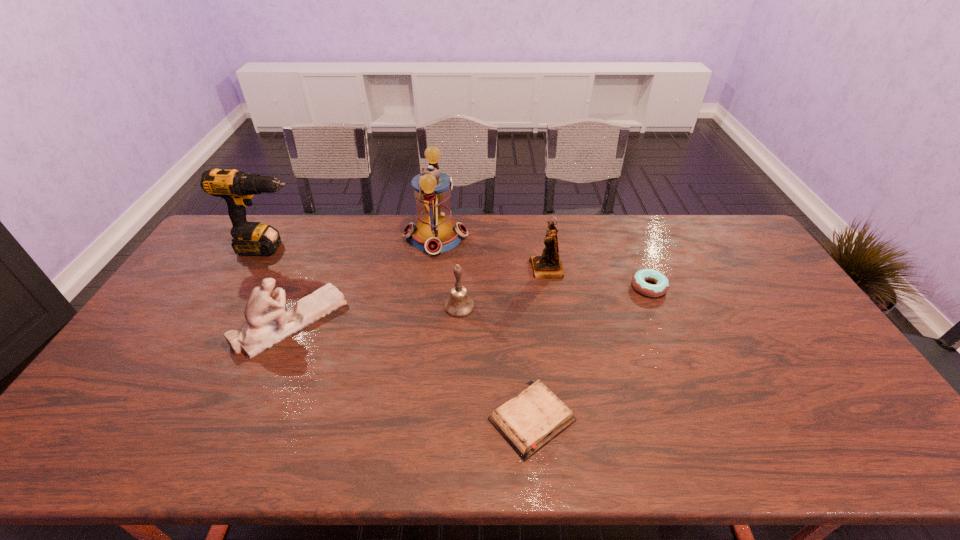
Where is `vacant space that satisfies the following two spatial constraints: 1. on the front-facing side of the farther figurine; 2. on the right side of the doughnut`? vacant space that satisfies the following two spatial constraints: 1. on the front-facing side of the farther figurine; 2. on the right side of the doughnut is located at coordinates (549, 287).

At what (x,y) coordinates should I click in order to perform the action: click on blank space that satisfies the following two spatial constraints: 1. on the front-facing side of the rightmost object; 2. on the left side of the lantern. Please return your answer as a coordinate pair (x, y). The height and width of the screenshot is (540, 960). Looking at the image, I should click on (430, 287).

Find the location of a particular element. The width and height of the screenshot is (960, 540). vacant point that satisfies the following two spatial constraints: 1. at the tip of the diary; 2. on the left side of the drill is located at coordinates (173, 420).

Image resolution: width=960 pixels, height=540 pixels. I want to click on vacant space that satisfies the following two spatial constraints: 1. on the front-facing side of the rightmost object; 2. on the left side of the lantern, so click(430, 287).

Locate an element on the screen. The image size is (960, 540). free space that satisfies the following two spatial constraints: 1. on the front-facing side of the bell; 2. on the left side of the lantern is located at coordinates (427, 306).

Where is `vacant space that satisfies the following two spatial constraints: 1. on the front-facing side of the lantern; 2. on the left side of the second shortest object`? The height and width of the screenshot is (540, 960). vacant space that satisfies the following two spatial constraints: 1. on the front-facing side of the lantern; 2. on the left side of the second shortest object is located at coordinates (430, 287).